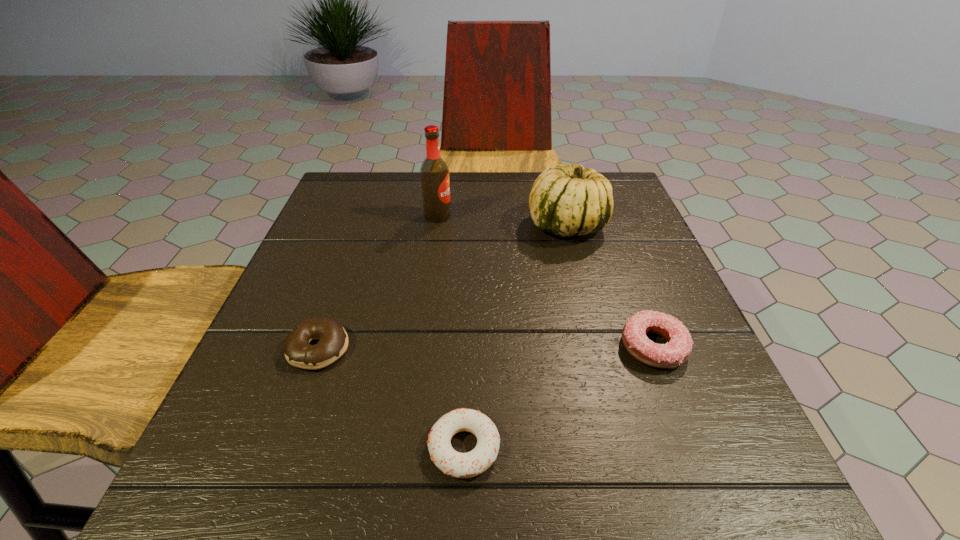
The width and height of the screenshot is (960, 540). I want to click on blank region between the rightmost doughnut and the tallest object, so click(545, 281).

This screenshot has height=540, width=960. In order to click on free space between the leftmost doughnut and the second tallest object in this screenshot , I will do `click(444, 287)`.

What are the coordinates of `vacant space in between the shortest object and the beer bottle` in the screenshot? It's located at (451, 332).

Select which object is the second closest to the rightmost doughnut. Please provide its 2D coordinates. Your answer should be formatted as a tuple, i.e. [(x, y)], where the tuple contains the x and y coordinates of a point satisfying the conditions above.

[(459, 465)]

Locate which object is the closest to the fourth shortest object. Please provide its 2D coordinates. Your answer should be formatted as a tuple, i.e. [(x, y)], where the tuple contains the x and y coordinates of a point satisfying the conditions above.

[(434, 172)]

This screenshot has width=960, height=540. I want to click on doughnut that stands as the closest to the leftmost doughnut, so click(459, 465).

You are a GUI agent. You are given a task and a screenshot of the screen. Output one action in this format:
    pyautogui.click(x=<x>, y=<y>)
    Task: Click on the doughnut that can be found as the second closest to the beer bottle
    This screenshot has height=540, width=960.
    Given the screenshot: What is the action you would take?
    676,351

The height and width of the screenshot is (540, 960). What are the coordinates of `free space that satisfies the following two spatial constraints: 1. on the front side of the leftmost doughnut; 2. on the right side of the shortest doughnut` in the screenshot? It's located at (284, 448).

Locate an element on the screen. The width and height of the screenshot is (960, 540). free space that satisfies the following two spatial constraints: 1. on the back side of the fourth shortest object; 2. on the left side of the nearest object is located at coordinates (470, 225).